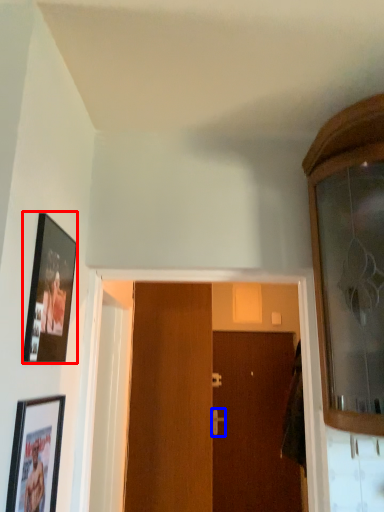
Question: Which of the following is the farthest to the observer, picture frame (highlighted by a red box) or door handle (highlighted by a blue box)?

Choices:
 (A) picture frame
 (B) door handle

Answer: (B)